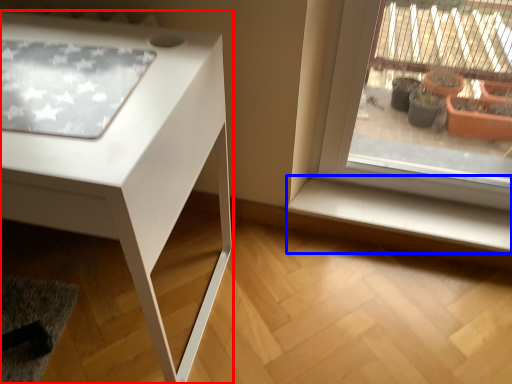
Question: Among these objects, which one is farthest to the camera, table (highlighted by a red box) or window sill (highlighted by a blue box)?

Choices:
 (A) table
 (B) window sill

Answer: (B)